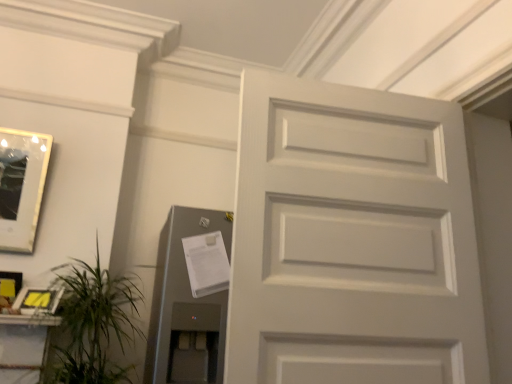
Question: Is white matte door at center in contact with green leafy plant at lower left?

Choices:
 (A) no
 (B) yes

Answer: (A)

Question: Is white matte door at center looking in the opposite direction of green leafy plant at lower left?

Choices:
 (A) no
 (B) yes

Answer: (A)

Question: Is white matte door at center thinner than green leafy plant at lower left?

Choices:
 (A) no
 (B) yes

Answer: (B)

Question: From a real-world perspective, does white matte door at center sit lower than green leafy plant at lower left?

Choices:
 (A) yes
 (B) no

Answer: (B)

Question: From the image's perspective, would you say white matte door at center is shown under green leafy plant at lower left?

Choices:
 (A) yes
 (B) no

Answer: (B)

Question: Does white matte door at center have a greater width compared to green leafy plant at lower left?

Choices:
 (A) yes
 (B) no

Answer: (B)

Question: Can you confirm if metallic gray elevator at lower left is wider than matte silver picture frame at lower left, the 3th picture frame from the top?

Choices:
 (A) no
 (B) yes

Answer: (B)

Question: From a real-world perspective, is metallic gray elevator at lower left positioned over matte silver picture frame at lower left, the 3th picture frame from the top, based on gravity?

Choices:
 (A) yes
 (B) no

Answer: (A)

Question: From the image's perspective, would you say metallic gray elevator at lower left is shown under matte silver picture frame at lower left, positioned as the first picture frame in bottom-to-top order?

Choices:
 (A) no
 (B) yes

Answer: (B)

Question: Is metallic gray elevator at lower left thinner than matte silver picture frame at lower left, the 3th picture frame from the top?

Choices:
 (A) yes
 (B) no

Answer: (B)

Question: Is metallic gray elevator at lower left facing towards matte silver picture frame at lower left, positioned as the first picture frame in bottom-to-top order?

Choices:
 (A) no
 (B) yes

Answer: (A)

Question: Considering the relative sizes of metallic gray elevator at lower left and matte silver picture frame at lower left, the 3th picture frame from the top, in the image provided, is metallic gray elevator at lower left taller than matte silver picture frame at lower left, the 3th picture frame from the top,?

Choices:
 (A) yes
 (B) no

Answer: (A)

Question: Is white matte door at center not close to metallic gray elevator at lower left?

Choices:
 (A) yes
 (B) no

Answer: (B)